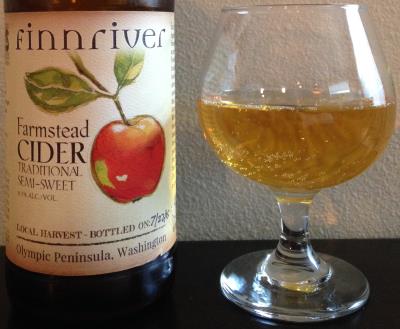
Locate an element on the screen. This screenshot has width=400, height=329. wall is located at coordinates (371, 182).